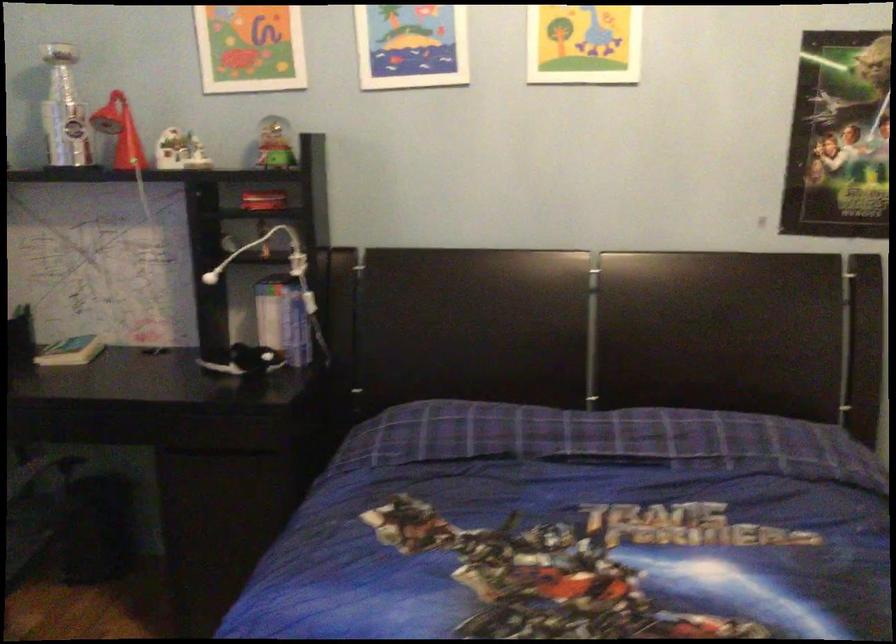
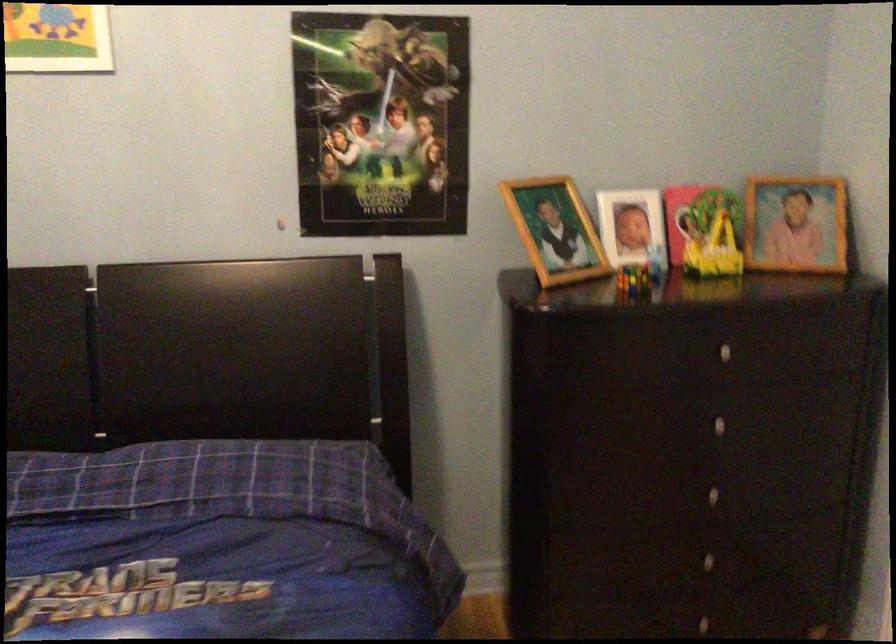
Question: The camera is either moving clockwise (left) or counter-clockwise (right) around the object. The first image is from the beginning of the video and the second image is from the end. Is the camera moving left or right when shooting the video?

Choices:
 (A) Left
 (B) Right

Answer: (A)